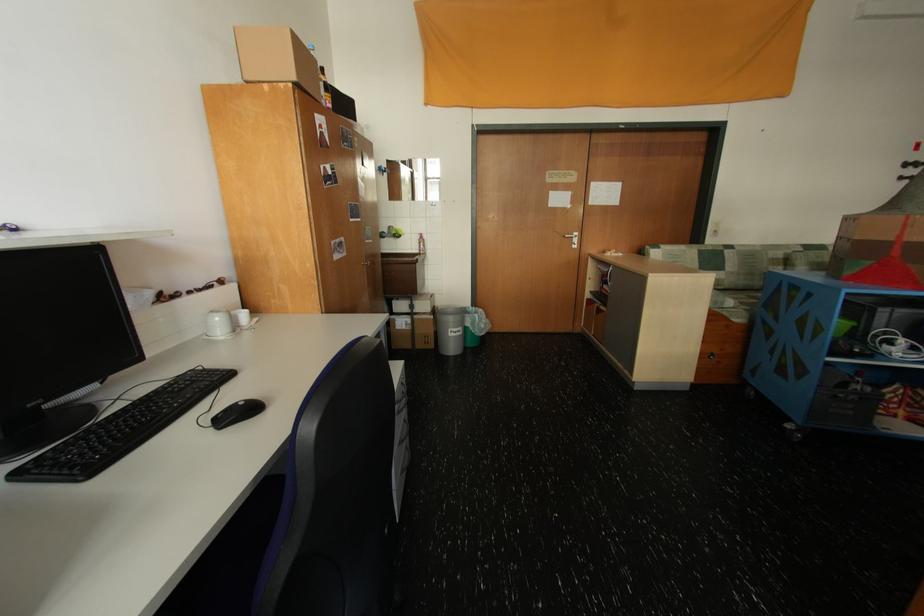
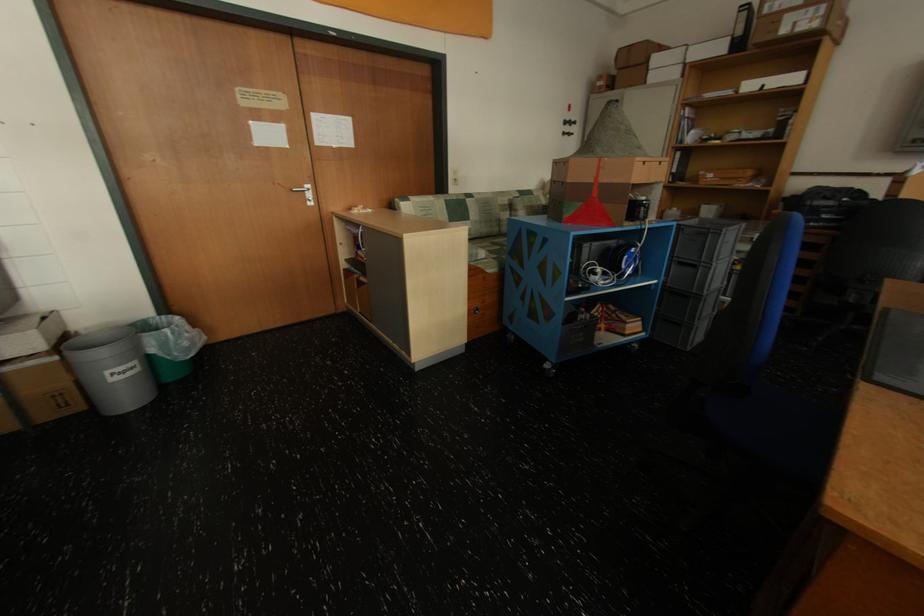
In the second image, find the point that corresponds to the point at 735,252 in the first image.

(476, 201)